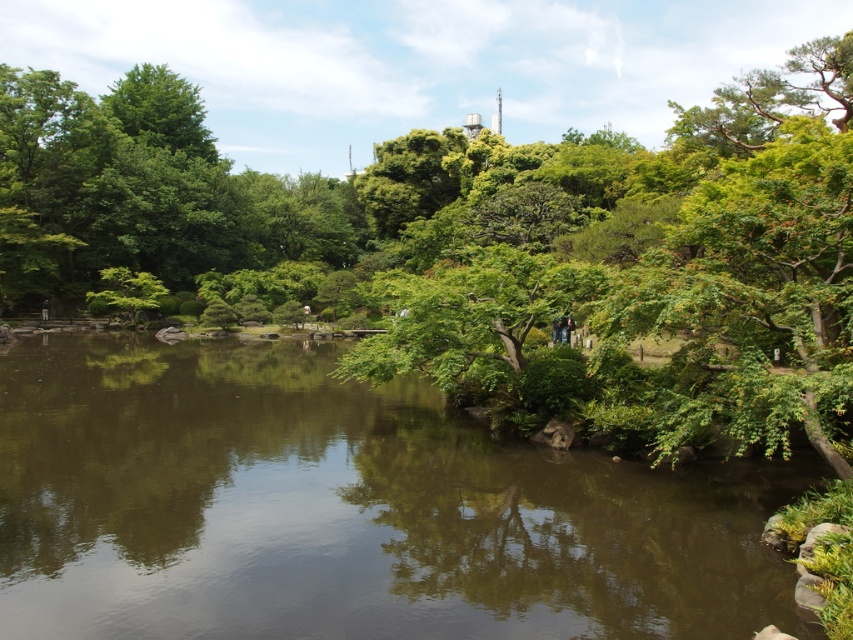
Can you confirm if green leafy tree at center is shorter than green reflective water at center?

In fact, green leafy tree at center may be taller than green reflective water at center.

Which of these two, green leafy tree at center or green reflective water at center, stands shorter?

Standing shorter between the two is green reflective water at center.

Who is more forward, [682,120] or [670,602]?

Point [670,602] is more forward.

This screenshot has height=640, width=853. I want to click on green leafy tree at center, so click(485, 240).